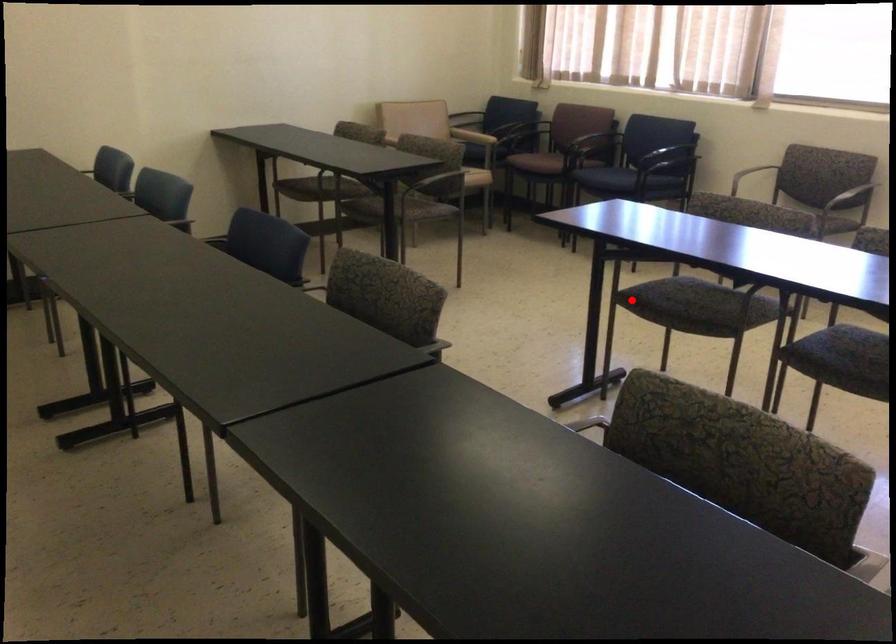
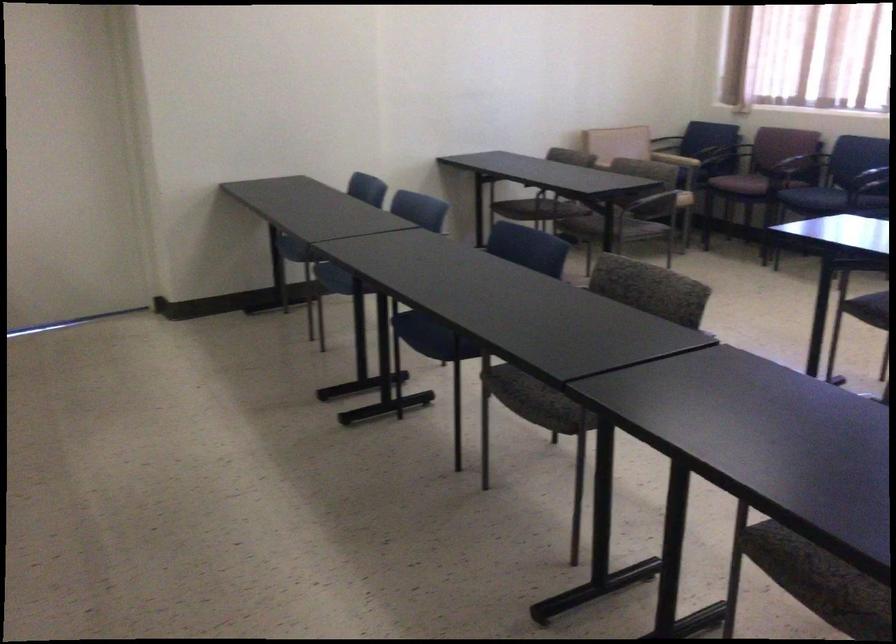
Where in the second image is the point corresponding to the highlighted location from the first image?

(868, 308)